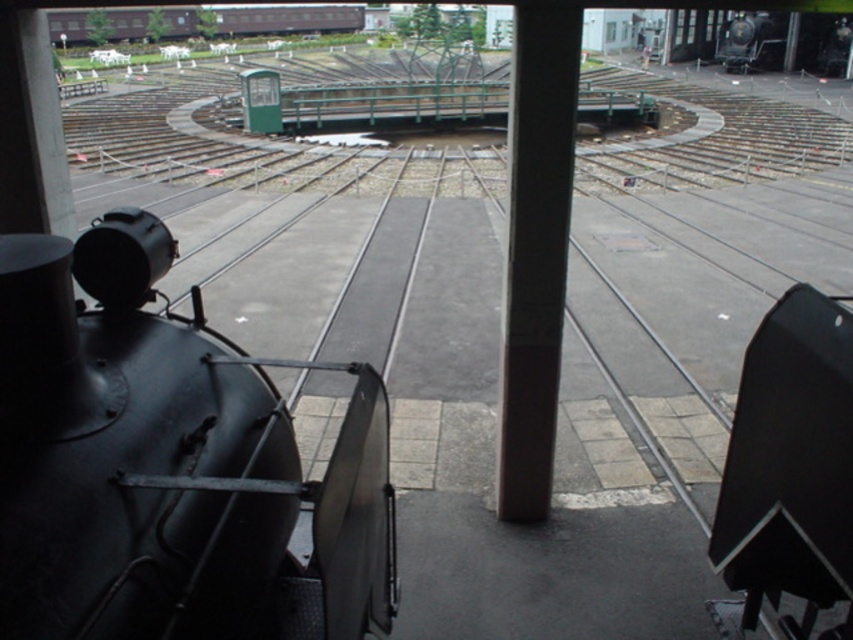
Which is below, matte black steam engine at left or smooth gray pole at center?

matte black steam engine at left

Is point (102, 460) in front of point (532, 99)?

Yes, point (102, 460) is closer to viewer.

You are a GUI agent. You are given a task and a screenshot of the screen. Output one action in this format:
    pyautogui.click(x=<x>, y=<y>)
    Task: Click on the matte black steam engine at left
    This screenshot has width=853, height=640.
    Given the screenshot: What is the action you would take?
    pyautogui.click(x=169, y=464)

Is smooth gray pole at center to the right of brown wooden train car at upper left from the viewer's perspective?

Correct, you'll find smooth gray pole at center to the right of brown wooden train car at upper left.

Is point (547, 156) behind point (227, 29)?

No.

Locate an element on the screen. The height and width of the screenshot is (640, 853). smooth gray pole at center is located at coordinates (537, 250).

Which is more to the left, matte black steam engine at left or brown wooden train car at upper left?

Positioned to the left is brown wooden train car at upper left.

Can you confirm if matte black steam engine at left is shorter than brown wooden train car at upper left?

Yes.

Who is more distant from viewer, (28, 264) or (62, 22)?

The point (62, 22) is behind.

Where is `matte black steam engine at left`? The image size is (853, 640). matte black steam engine at left is located at coordinates (169, 464).